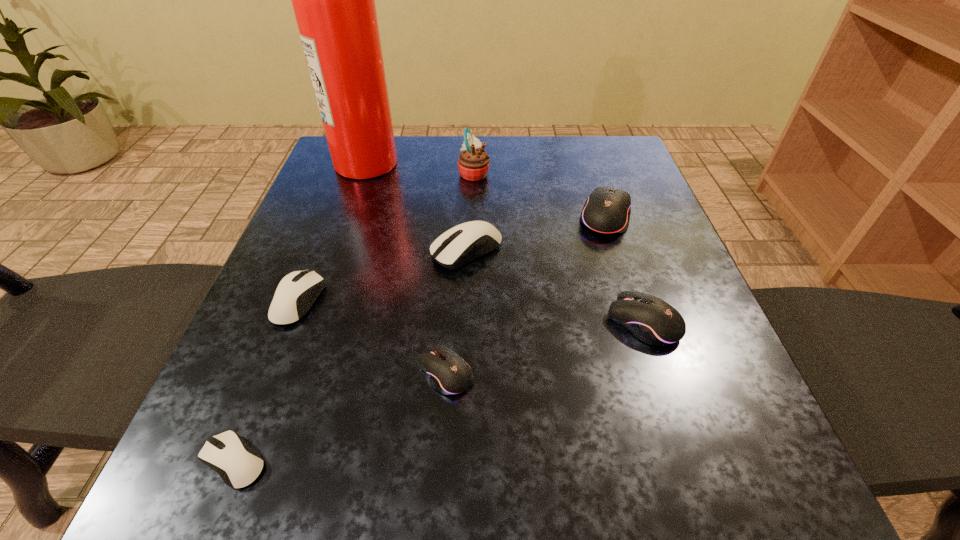
Find the location of a particular element. This screenshot has height=540, width=960. vacant area at the far left corner is located at coordinates (343, 180).

Image resolution: width=960 pixels, height=540 pixels. What are the coordinates of `free space at the far right corner of the desktop` in the screenshot? It's located at coord(598,179).

The height and width of the screenshot is (540, 960). I want to click on free space between the smallest black computer mouse and the nearest object, so click(x=340, y=416).

The width and height of the screenshot is (960, 540). I want to click on empty space between the smallest black computer mouse and the pink muffin, so click(x=460, y=273).

Find the location of a particular element. This screenshot has height=540, width=960. free space between the farthest white mouse and the tallest object is located at coordinates (417, 206).

Identify the location of vacant area that lies between the biggest white mouse and the biggest black computer mouse. (537, 234).

You are a GUI agent. You are given a task and a screenshot of the screen. Output one action in this format:
    pyautogui.click(x=<x>, y=<y>)
    Task: Click on the free space between the shortest object and the leftmost black computer mouse
    
    Given the screenshot: What is the action you would take?
    pyautogui.click(x=340, y=416)

Locate an element on the screen. free point between the nearest object and the smallest black computer mouse is located at coordinates (340, 416).

This screenshot has width=960, height=540. Find the location of `free space between the biggest white mouse and the third tallest object`. free space between the biggest white mouse and the third tallest object is located at coordinates (537, 234).

Where is `vacant space that's between the second tallest object and the nearest mouse`? vacant space that's between the second tallest object and the nearest mouse is located at coordinates (354, 317).